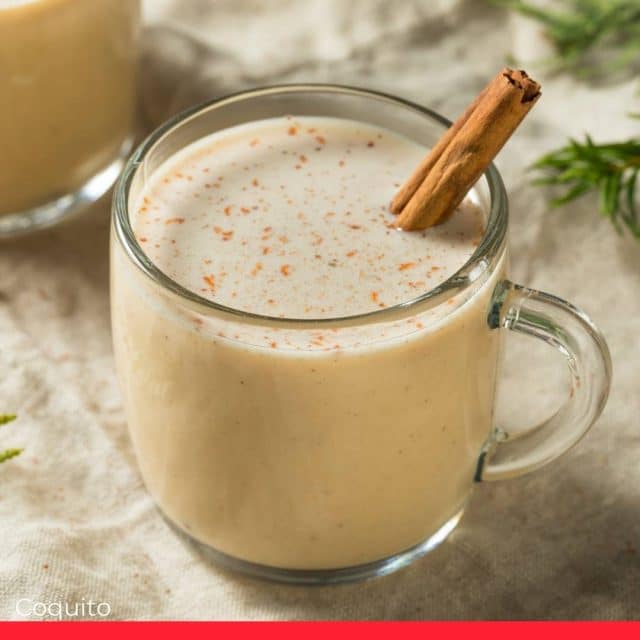
What are the coordinates of `handle` in the screenshot? It's located at (585, 349).